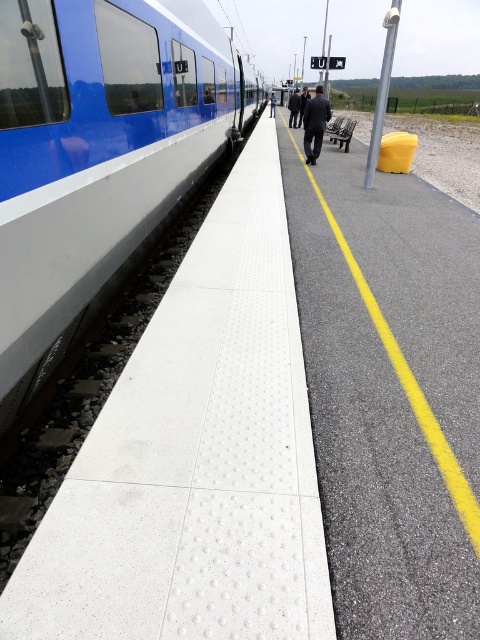
You are a passenger waiting on the platform. You see the blue glossy train at left and the black fabric coat at center. Which object takes up more area on the platform?

The black fabric coat at center takes up more area on the platform than the blue glossy train at left.

You are standing at the center of the platform and want to board the blue glossy train at left. Which direction should you walk to reach it?

You should walk to the left to reach the blue glossy train at left since it is located at the left side of the platform.